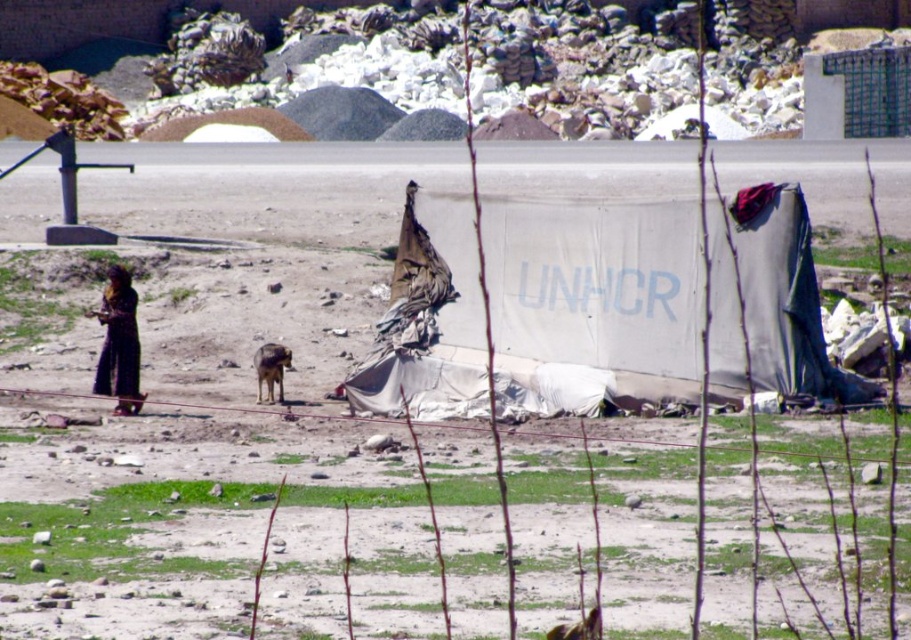
Can you confirm if white tarp at center is positioned above black fabric at left?

Yes, white tarp at center is above black fabric at left.

From the picture: Is white tarp at center behind black fabric at left?

No.

Which is in front, point (461, 301) or point (111, 381)?

Point (111, 381) is more forward.

Identify the location of white tarp at center. The width and height of the screenshot is (911, 640). (592, 301).